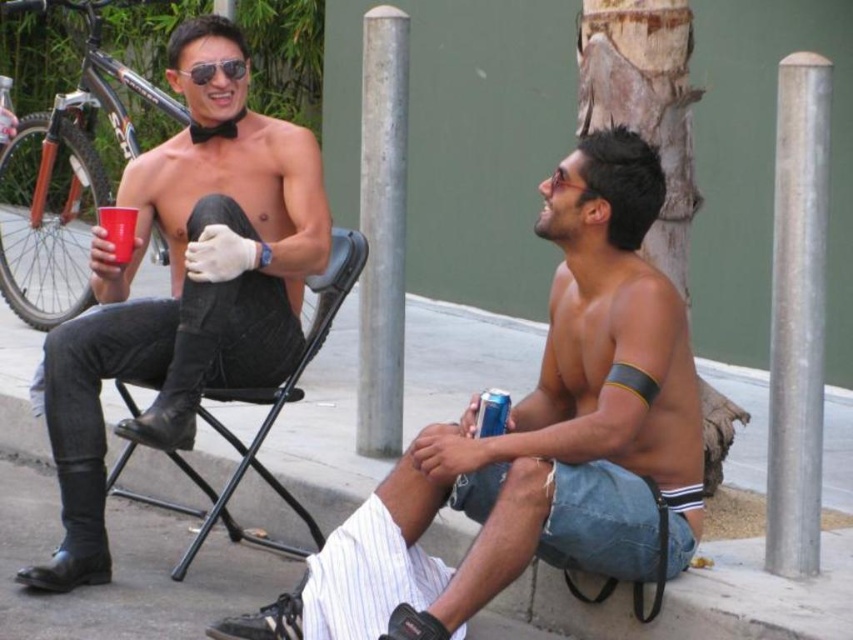
Consider the image. You are a photographer trying to capture a candid shot of the two men without them noticing. You want to position your camera so that the shiny black leather boots at left and the silver metallic pole at center right are both in the frame. Based on their positions, which object should you place closer to the left edge of the photo?

The shiny black leather boots at left should be placed closer to the left edge of the photo because it is positioned on the left side of the silver metallic pole at center right.

You are a delivery robot with a width of 1 meter. You need to move from the black leather chair at center to the sunglasses at upper center. Is there enough space for you to pass through the area between them?

The distance between the black leather chair at center and the sunglasses at upper center is 1.37 meters. Since the robot is 1 meter wide, there is sufficient space for it to pass through the area between them.

You are standing in the middle of the sidewalk and want to move to the silver metallic pole at center. Which direction should you move relative to the black leather chair at center?

The silver metallic pole at center is to the right of the black leather chair at center, so you should move to the right relative to the black leather chair at center to reach it.